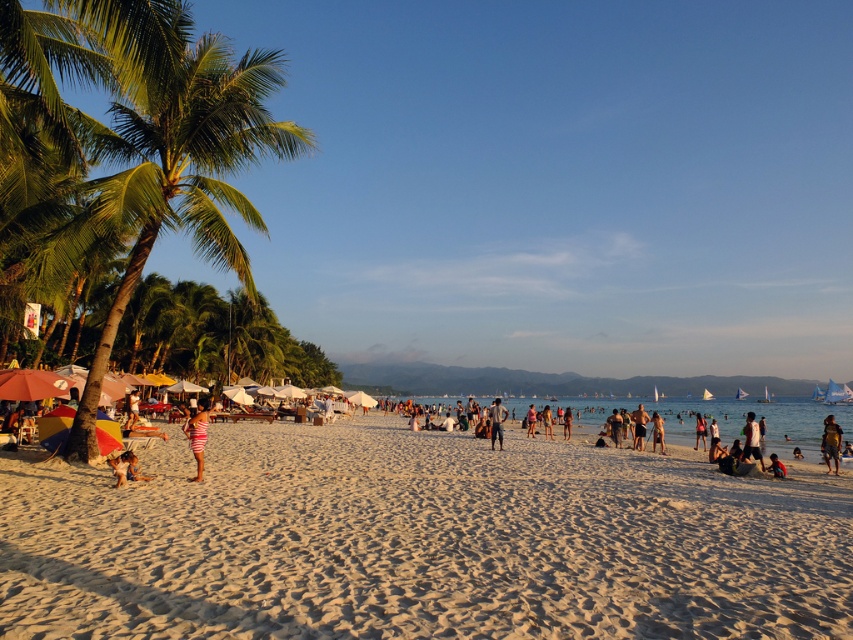
Is white cotton shirt at center positioned before tan skin person at center?

Yes.

Consider the image. Which of these two, white cotton shirt at center or tan skin person at center, stands shorter?

tan skin person at center is shorter.

Does point (746, 429) come behind point (630, 416)?

No, it is not.

Locate an element on the screen. This screenshot has height=640, width=853. white cotton shirt at center is located at coordinates (751, 440).

The width and height of the screenshot is (853, 640). Describe the element at coordinates (831, 442) in the screenshot. I see `dark brown wooden surfboard at lower right` at that location.

Does dark brown wooden surfboard at lower right lie in front of light brown sand at center?

Yes, dark brown wooden surfboard at lower right is closer to the viewer.

The height and width of the screenshot is (640, 853). In order to click on dark brown wooden surfboard at lower right in this screenshot , I will do `click(831, 442)`.

Who is lower down, green leafy palm tree at left or light brown sand at center?

Positioned lower is light brown sand at center.

Is point (254, 109) positioned behind point (490, 428)?

No, (254, 109) is in front of (490, 428).

This screenshot has width=853, height=640. I want to click on green leafy palm tree at left, so click(184, 177).